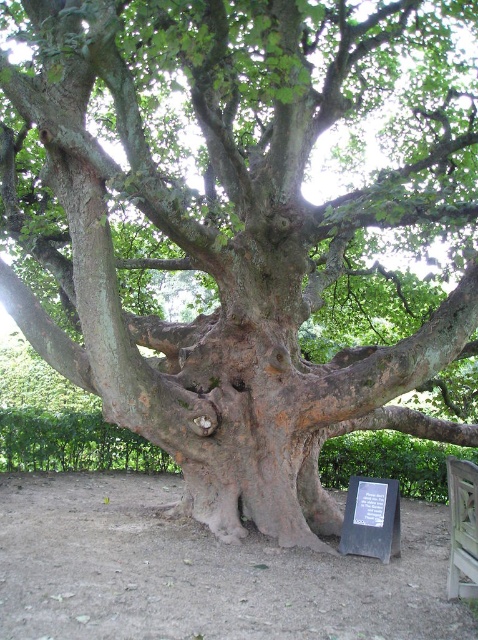
Does black stone plaque at lower center appear under wooden bench at lower right?

Yes.

In the scene shown: Who is more forward, (377, 486) or (468, 570)?

Point (468, 570) is in front.

This screenshot has width=478, height=640. I want to click on black stone plaque at lower center, so click(371, 518).